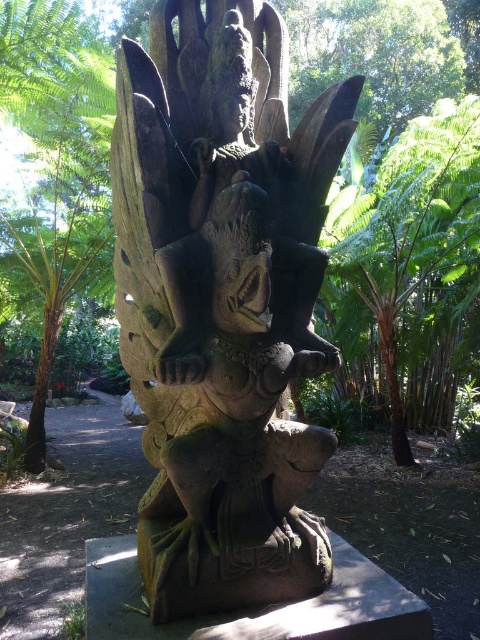
In the scene shown: You are standing in a tropical garden and see the dark stone statue at center. If you take one step forward, will you be closer than 5 feet to the statue?

The dark stone statue at center is 5.71 feet from viewer. Taking one step forward would reduce the distance, but unless the step is at least 0.71 feet, you might still be slightly over 5 feet away. However, typical step lengths are longer, so likely yes, you would be closer than 5 feet.

You are a photographer standing at a certain distance from the dark stone statue at center. You want to capture a full view of the statue without any cropping. Your camera has a minimum focusing distance of 6 feet. Will you be able to take the photo clearly?

The distance between the dark stone statue at center and the camera is 5.71 feet, which is less than the camera minimum focusing distance of 6 feet. Therefore, you cannot take the photo clearly as the camera cannot focus at that distance.

You are a photographer wanting to capture the dark stone statue at center against a clear background. Since you see the green leafy tree at left, how can you adjust your position to ensure the tree isn

Move to the side so that the dark stone statue at center is positioned between you and the green leafy tree at left. This way, the statue will block the tree, providing a clear background.